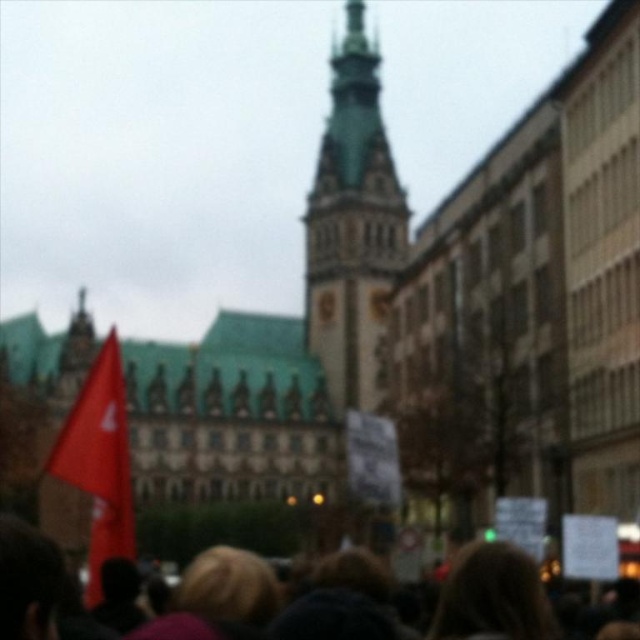
Question: Which object appears closest to the camera in this image?

Choices:
 (A) matte red flag at left
 (B) blurred hair at lower center
 (C) green stone tower at center

Answer: (B)

Question: Among these objects, which one is farthest from the camera?

Choices:
 (A) matte red flag at left
 (B) blurred hair at lower center
 (C) green stone tower at center

Answer: (C)

Question: Which of the following is the closest to the observer?

Choices:
 (A) blurred hair at lower center
 (B) matte red flag at left

Answer: (A)

Question: Can you confirm if green stone tower at center is thinner than matte red flag at left?

Choices:
 (A) yes
 (B) no

Answer: (B)

Question: Is green stone tower at center wider than matte red flag at left?

Choices:
 (A) yes
 (B) no

Answer: (A)

Question: Is green stone tower at center closer to camera compared to blurred hair at lower center?

Choices:
 (A) no
 (B) yes

Answer: (A)